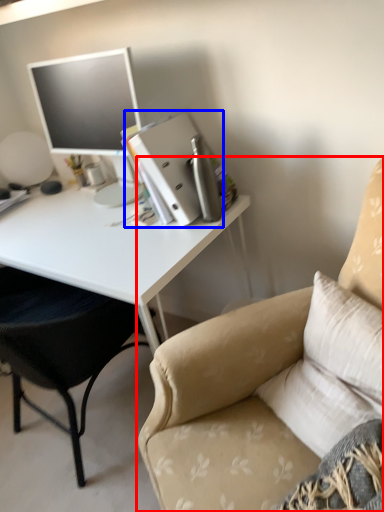
Question: Among these objects, which one is nearest to the camera, chair (highlighted by a red box) or binder (highlighted by a blue box)?

Choices:
 (A) chair
 (B) binder

Answer: (A)